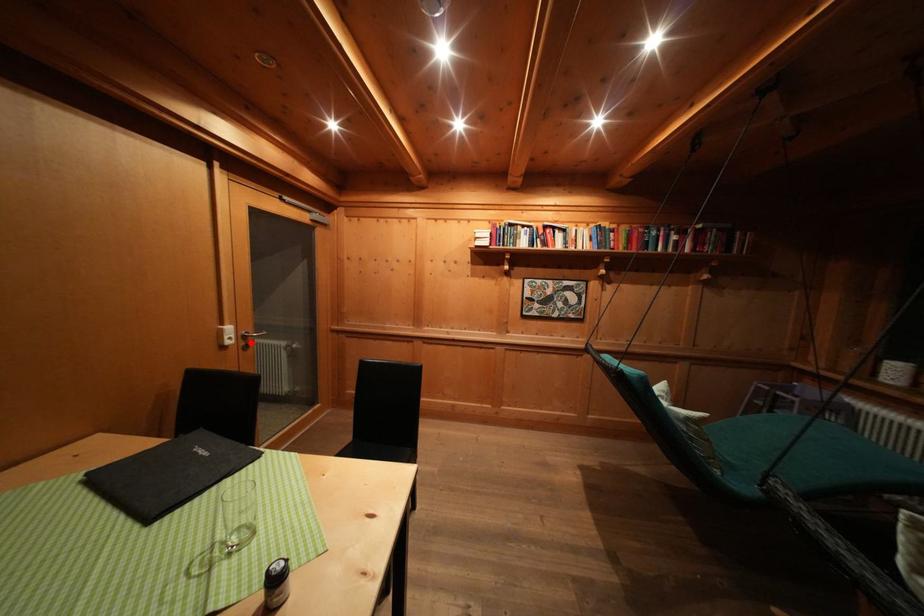
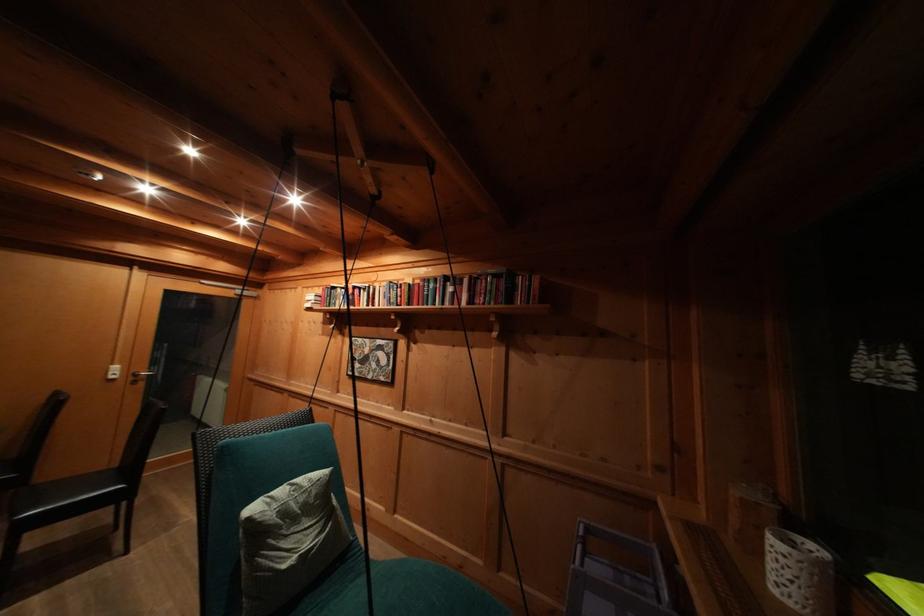
In the second image, find the point that corresponds to the highlighted location in the first image.

(141, 379)